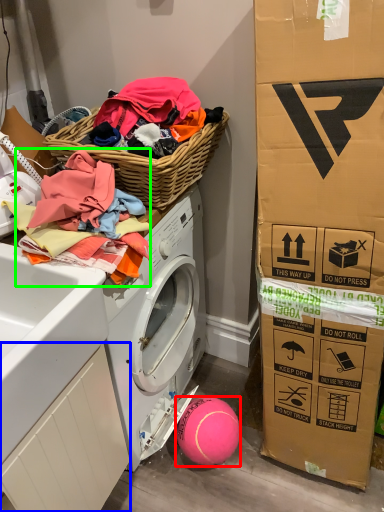
Question: Which object is the farthest from ball (highlighted by a red box)? Choose among these: drawer (highlighted by a blue box) or clothing (highlighted by a green box).

Choices:
 (A) drawer
 (B) clothing

Answer: (B)